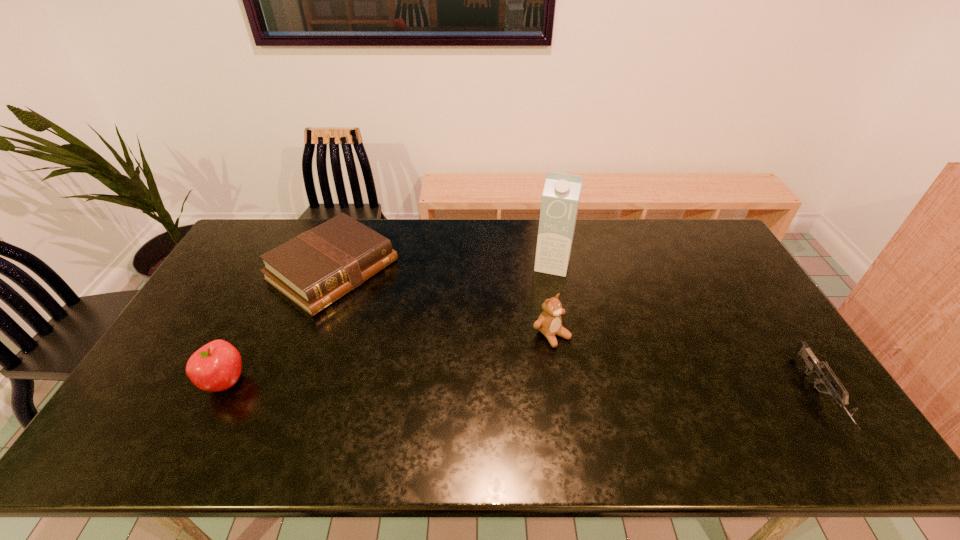
Image resolution: width=960 pixels, height=540 pixels. I want to click on vacant area situated 0.130m on the front-facing side of the teddy bear, so click(598, 379).

Find the location of a particular element. The image size is (960, 540). blank area located 0.160m on the front-facing side of the teddy bear is located at coordinates (606, 387).

The image size is (960, 540). Find the location of `free space located on the front-facing side of the teddy bear`. free space located on the front-facing side of the teddy bear is located at coordinates (624, 404).

Where is `free space located 0.320m on the spine side of the fourth tallest object`? The width and height of the screenshot is (960, 540). free space located 0.320m on the spine side of the fourth tallest object is located at coordinates (451, 349).

Where is `blank area located on the spine side of the fourth tallest object`? The width and height of the screenshot is (960, 540). blank area located on the spine side of the fourth tallest object is located at coordinates (473, 364).

Identify the location of free space located 0.170m on the spine side of the fourth tallest object. The width and height of the screenshot is (960, 540). (414, 325).

You are a GUI agent. You are given a task and a screenshot of the screen. Output one action in this format:
    pyautogui.click(x=<x>, y=<y>)
    Task: Click on the carton at the far edge
    This screenshot has height=540, width=960.
    Given the screenshot: What is the action you would take?
    coord(560,200)

This screenshot has height=540, width=960. In order to click on Bible located at the far edge in this screenshot , I will do `click(316, 268)`.

Locate an element on the screen. apple that is at the near edge is located at coordinates (216, 366).

At what (x,y) coordinates should I click in order to perform the action: click on gun that is positioned at the near edge. Please return your answer as a coordinate pair (x, y). Looking at the image, I should click on (812, 363).